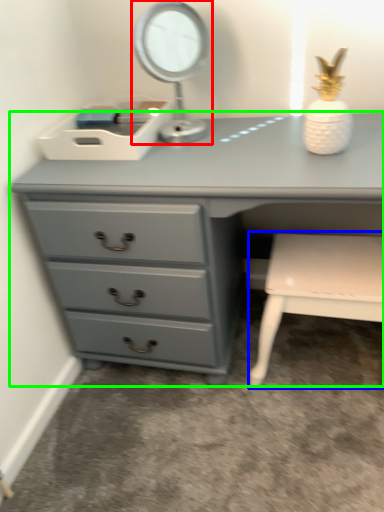
Question: Estimate the real-world distances between objects in this image. Which object is farther from table lamp (highlighted by a red box), chair (highlighted by a blue box) or chest of drawers (highlighted by a green box)?

Choices:
 (A) chair
 (B) chest of drawers

Answer: (A)